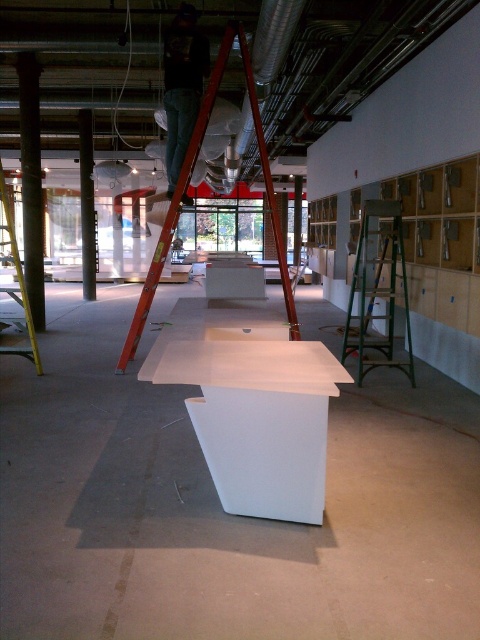
Looking at this image, you are an interior designer who needs to place a new sofa that is 1.5 meters wide. You see the white glossy table at center and the metallic red ladder at upper center in the room. Which object has a smaller width and can accommodate the sofa next to it?

The white glossy table at center has a smaller width than the metallic red ladder at upper center, so it can accommodate the sofa next to it.

You are a photographer setting up a camera in an unfinished indoor space. You want to place the camera so that it is exactly 8 feet away from the white glossy table at center. Given that the camera is currently positioned at the same spot as the red ladder, is the ladder close enough to the table to meet your requirement?

The white glossy table at center and camera are 7.81 feet apart from each other. Since 7.81 feet is less than 8 feet, the ladder is close enough to the table to meet the requirement.

You are a delivery person who just arrived at the construction site. You need to place a large package that is 2 meters in length on the white glossy table at center. Can you fit the package on the table without moving it?

The white glossy table at center is 2.38 meters away from the camera. The distance does not indicate the table size, so we cannot determine if the package will fit based on the given information.